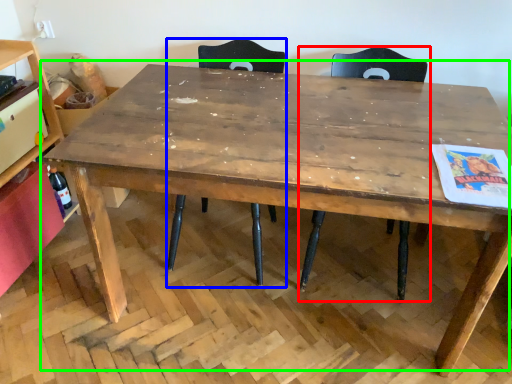
Question: Which object is the farthest from chair (highlighted by a red box)? Choose among these: chair (highlighted by a blue box) or table (highlighted by a green box).

Choices:
 (A) chair
 (B) table

Answer: (B)